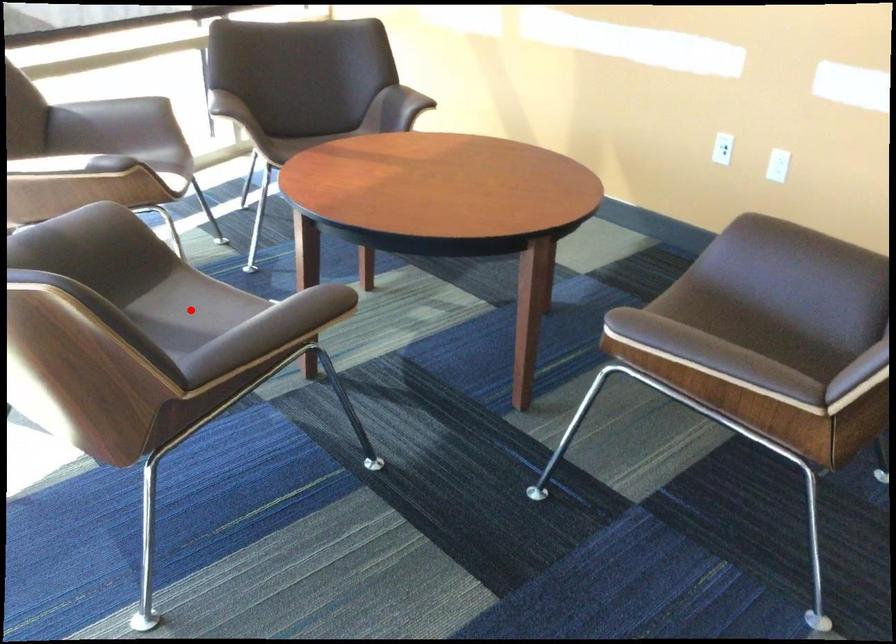
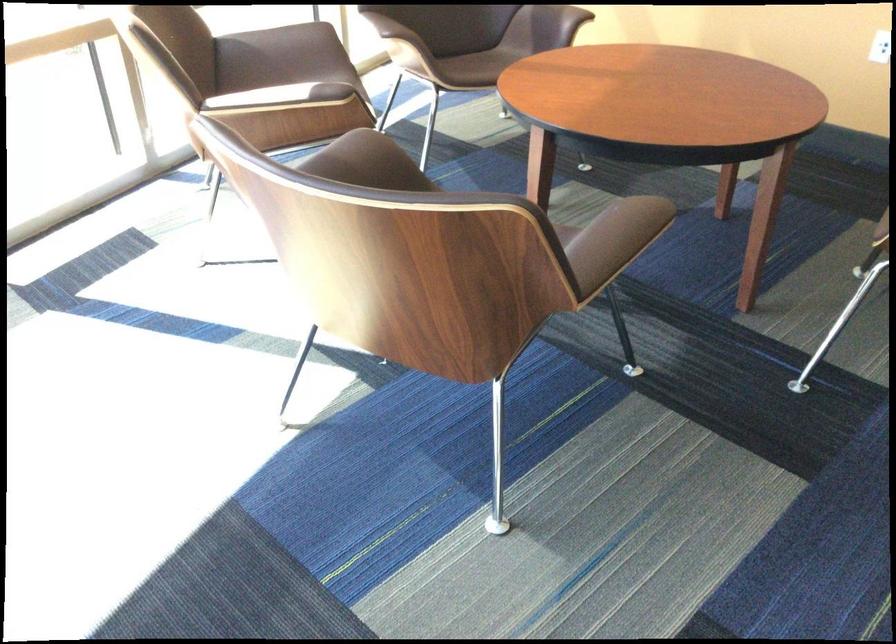
Question: I am providing you with two images of the same scene from different viewpoints. A red point is marked on the first image. At the location where the point appears in image 1, is it still visible in image 2?

Choices:
 (A) Yes
 (B) No

Answer: (B)